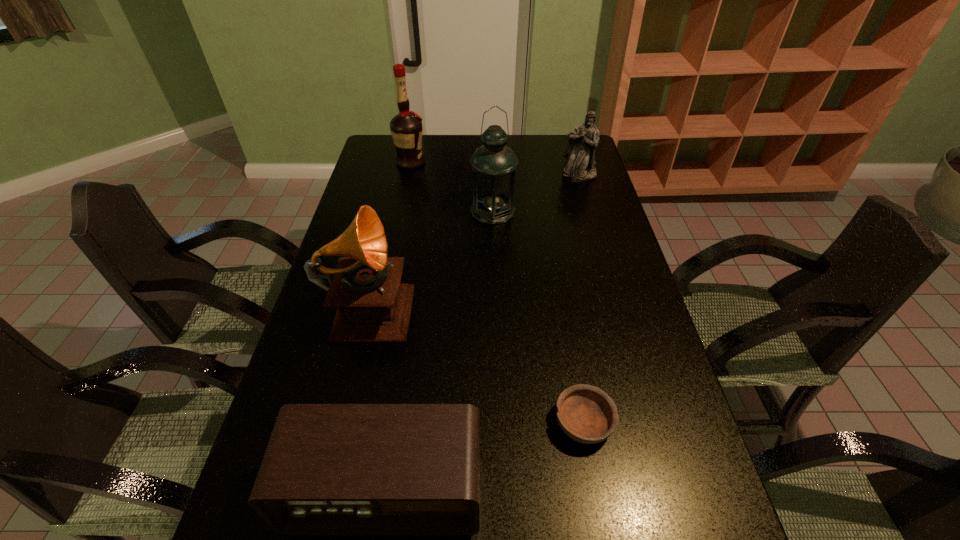
Locate an element on the screen. object present at the far left corner is located at coordinates (406, 128).

Where is `blank space at the far edge of the desktop`? The image size is (960, 540). blank space at the far edge of the desktop is located at coordinates pos(539,159).

At what (x,y) coordinates should I click in order to perform the action: click on vacant region at the left edge. Please return your answer as a coordinate pair (x, y). The image size is (960, 540). Looking at the image, I should click on (x=382, y=200).

Where is `vacant point at the right edge`? vacant point at the right edge is located at coordinates (575, 224).

Image resolution: width=960 pixels, height=540 pixels. In order to click on vacant space at the far right corner of the desktop in this screenshot , I will do `click(549, 134)`.

The height and width of the screenshot is (540, 960). I want to click on vacant area that lies between the rightmost object and the third farthest object, so click(536, 193).

The height and width of the screenshot is (540, 960). In order to click on vacant area that lies between the phonograph record and the liquor in this screenshot , I will do (390, 233).

I want to click on free spot between the third shortest object and the oil lamp, so click(536, 193).

Locate an element on the screen. This screenshot has height=540, width=960. blank region between the fourth tallest object and the fourth farthest object is located at coordinates (474, 239).

At what (x,y) coordinates should I click in order to perform the action: click on free space between the third nearest object and the bowl. Please return your answer as a coordinate pair (x, y). This screenshot has height=540, width=960. Looking at the image, I should click on (476, 363).